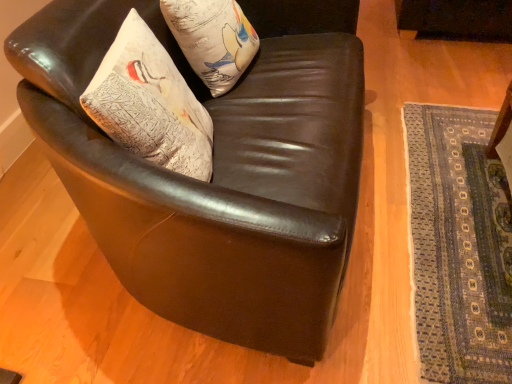
Question: Does textured white pillow at upper left touch textured white pillow at upper left?

Choices:
 (A) no
 (B) yes

Answer: (A)

Question: Does textured white pillow at upper left lie in front of textured white pillow at upper left?

Choices:
 (A) yes
 (B) no

Answer: (A)

Question: From a real-world perspective, is textured white pillow at upper left beneath textured white pillow at upper left?

Choices:
 (A) no
 (B) yes

Answer: (A)

Question: Is textured white pillow at upper left inside textured white pillow at upper left?

Choices:
 (A) yes
 (B) no

Answer: (B)

Question: Are textured white pillow at upper left and textured white pillow at upper left far apart?

Choices:
 (A) no
 (B) yes

Answer: (A)

Question: In the image, is blue woven mat at lower right positioned in front of or behind shiny brown leather armchair at center?

Choices:
 (A) front
 (B) behind

Answer: (B)

Question: Is blue woven mat at lower right wider or thinner than shiny brown leather armchair at center?

Choices:
 (A) thin
 (B) wide

Answer: (B)

Question: From the image's perspective, is blue woven mat at lower right located above or below shiny brown leather armchair at center?

Choices:
 (A) above
 (B) below

Answer: (B)

Question: Looking at the image, does blue woven mat at lower right seem bigger or smaller compared to shiny brown leather armchair at center?

Choices:
 (A) big
 (B) small

Answer: (B)

Question: Is point (237, 56) positioned closer to the camera than point (113, 100)?

Choices:
 (A) farther
 (B) closer

Answer: (A)

Question: From the image's perspective, is textured white pillow at upper left above or below textured white pillow at upper left?

Choices:
 (A) below
 (B) above

Answer: (B)

Question: In terms of width, does textured white pillow at upper left look wider or thinner when compared to textured white pillow at upper left?

Choices:
 (A) wide
 (B) thin

Answer: (A)

Question: Is textured white pillow at upper left inside or outside of textured white pillow at upper left?

Choices:
 (A) outside
 (B) inside

Answer: (A)

Question: Does point (330, 241) appear closer or farther from the camera than point (185, 56)?

Choices:
 (A) closer
 (B) farther

Answer: (A)

Question: Is shiny brown leather armchair at center to the left or to the right of textured white pillow at upper left in the image?

Choices:
 (A) right
 (B) left

Answer: (A)